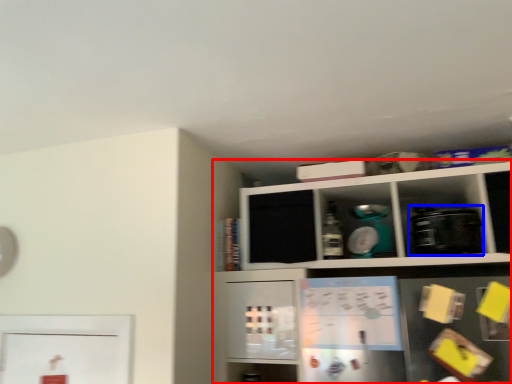
Question: Which point is further to the camera, shelf (highlighted by a red box) or appliance (highlighted by a blue box)?

Choices:
 (A) shelf
 (B) appliance

Answer: (B)